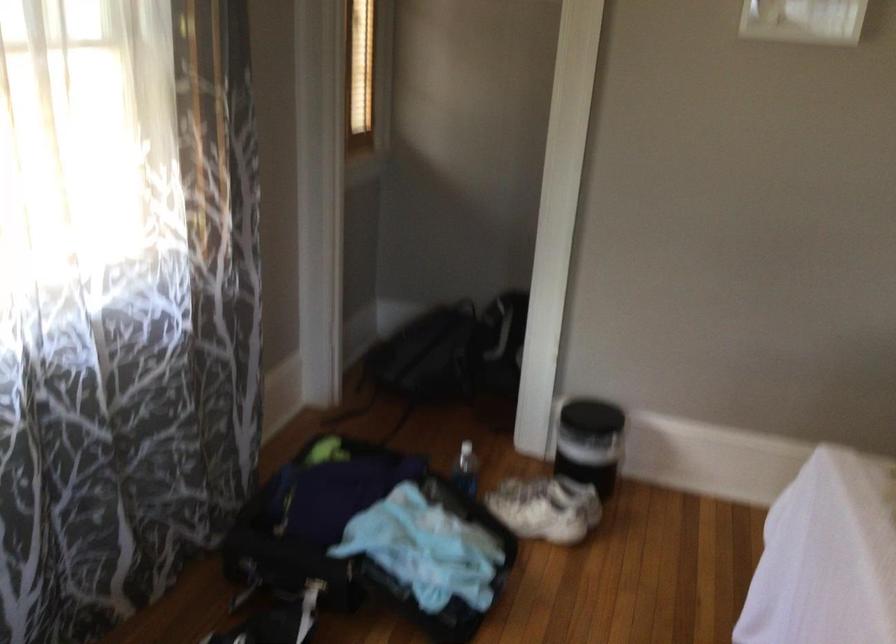
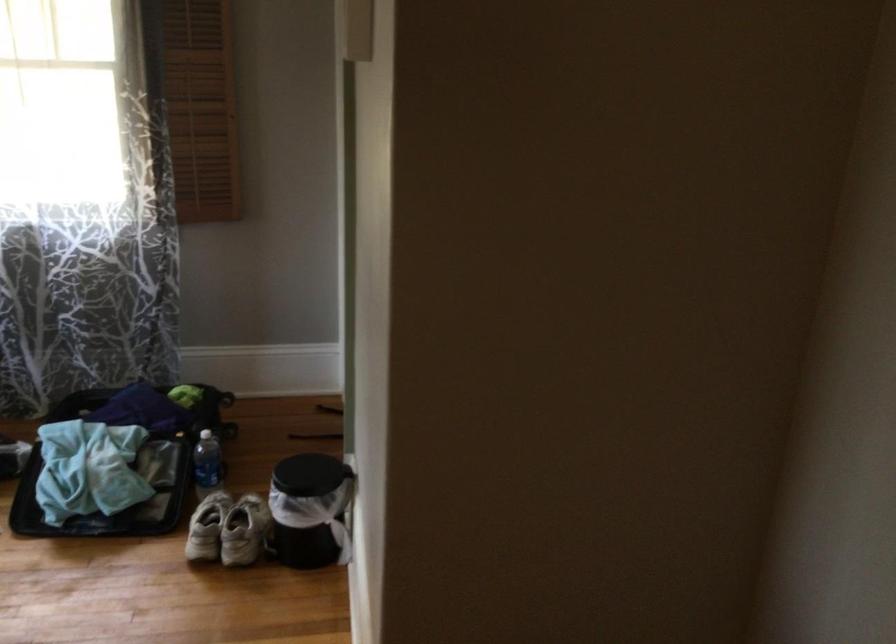
In the second image, find the point that corresponds to point 623,435 in the first image.

(309, 509)